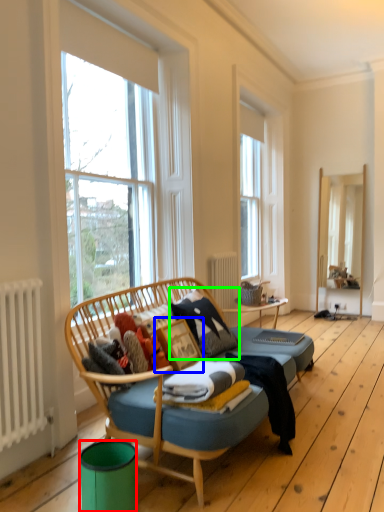
Question: Considering the real-world distances, which object is closest to trash bin/can (highlighted by a red box)? picture frame (highlighted by a blue box) or pillow (highlighted by a green box).

Choices:
 (A) picture frame
 (B) pillow

Answer: (A)